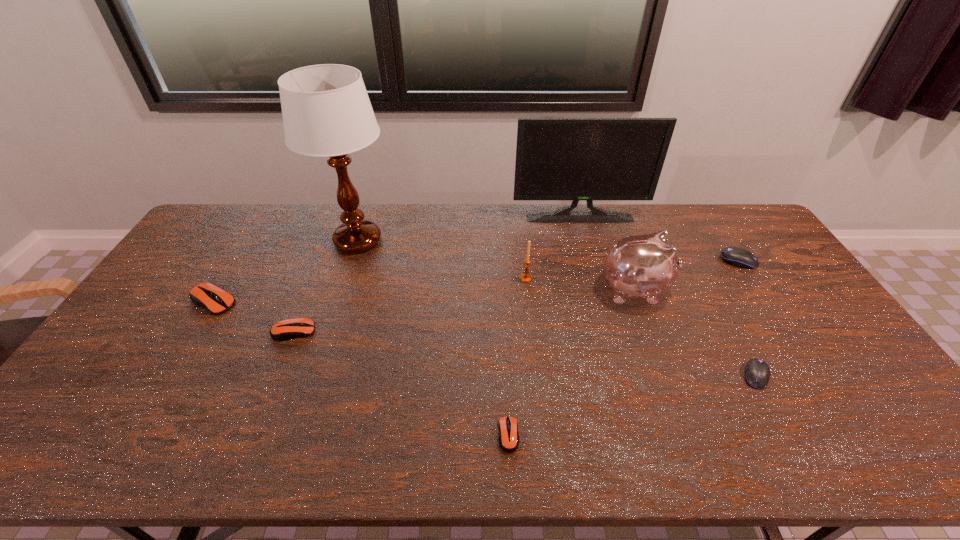
You are a GUI agent. You are given a task and a screenshot of the screen. Output one action in this format:
    pyautogui.click(x=<x>, y=<y>)
    Task: Click on the tallest object
    
    Given the screenshot: What is the action you would take?
    click(326, 111)

The height and width of the screenshot is (540, 960). What are the coordinates of `white table lamp` in the screenshot? It's located at (326, 111).

The height and width of the screenshot is (540, 960). What are the coordinates of `the eighth shortest object` in the screenshot? It's located at (575, 159).

Locate an element on the screen. piggy bank is located at coordinates (645, 266).

Identify the location of the fourth tallest object. (526, 277).

This screenshot has width=960, height=540. What are the coordinates of `the leftmost orange computer mouse` in the screenshot? It's located at (209, 296).

At what (x,y) coordinates should I click in order to perform the action: click on the leftmost computer mouse. Please return your answer as a coordinate pair (x, y). Looking at the image, I should click on (209, 296).

Where is `the rightmost object`? the rightmost object is located at coordinates (736, 256).

Locate an element on the screen. This screenshot has width=960, height=540. the rightmost computer mouse is located at coordinates (736, 256).

Where is `the second biggest orange computer mouse`? This screenshot has height=540, width=960. the second biggest orange computer mouse is located at coordinates (288, 329).